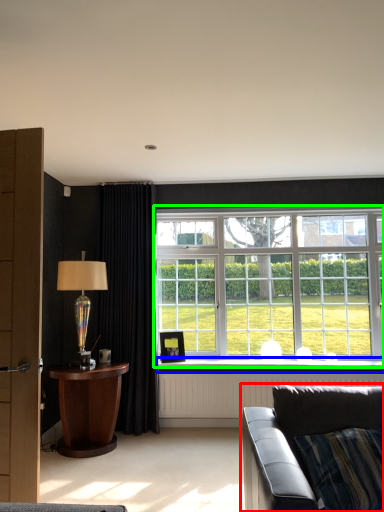
Question: Which object is positioned closest to studio couch (highlighted by a red box)? Select from window sill (highlighted by a blue box) and window (highlighted by a green box).

Choices:
 (A) window sill
 (B) window

Answer: (A)